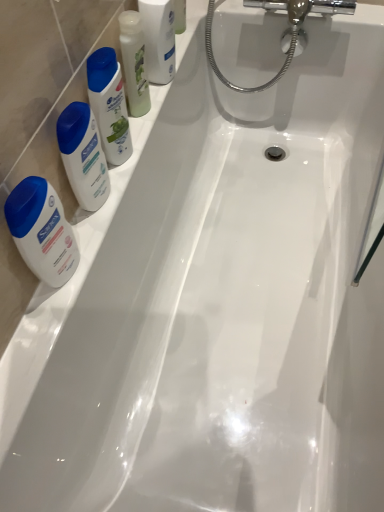
What are the coordinates of `vacant region in front of matte white shampoo at left, the 1th cleaning product when ordered from bottom to top` in the screenshot? It's located at (77, 259).